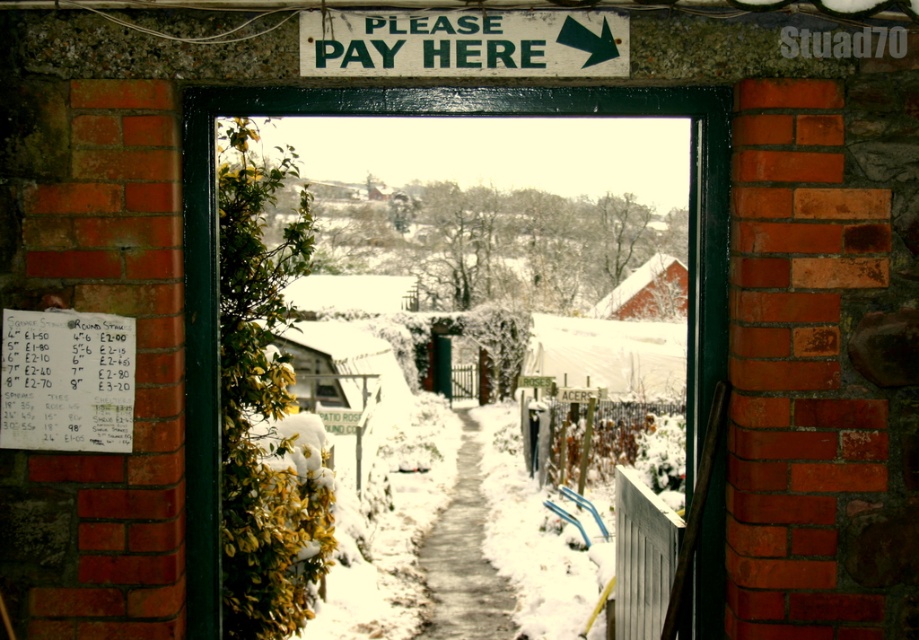
From the picture: You are a delivery robot with a 1.2 meter wide package. You need to enter the village through the green wooden door at center. Can you fit through the doorway if the green painted wooden sign at upper center is 1 meter wide?

The green wooden door at center might be wider than green painted wooden sign at upper center. Since the sign is 1 meter wide, the door could be wider than 1 meter. If the door is wider than 1.2 meters, the package can fit through. However, without exact measurements, it is uncertain. Please check the door width before proceeding.

You are standing outside the green wooden door at center and want to read the green painted wooden sign at upper center. Which direction should you move to get closer to the sign?

You should move forward towards the green painted wooden sign at upper center because the green wooden door at center is closer to you than the sign.

In the scene shown: You are standing in front of the snowy scene through the doorway. The green wooden door at center is located at point (428, 115). You want to walk towards the door. Which direction should you move in relation to the snow covered path leading into the village?

The green wooden door at center is located at point (428, 115). Since the snow covered path leads into the village, you should move towards the door by walking along the path towards the center where the door is located.